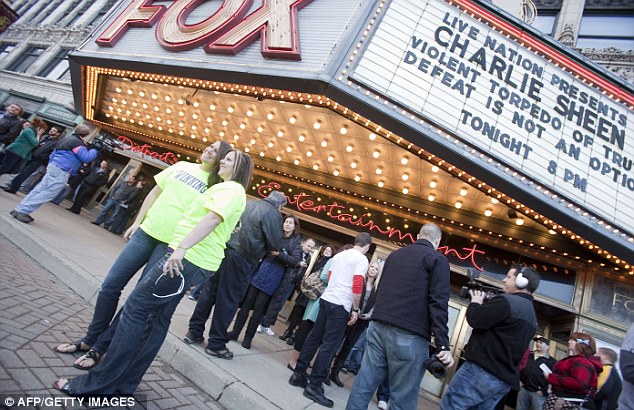
This screenshot has height=410, width=634. I want to click on hot lights, so click(x=378, y=168), click(x=269, y=151), click(x=430, y=188), click(x=283, y=135), click(x=347, y=154), click(x=186, y=120), click(x=146, y=120), click(x=300, y=127).